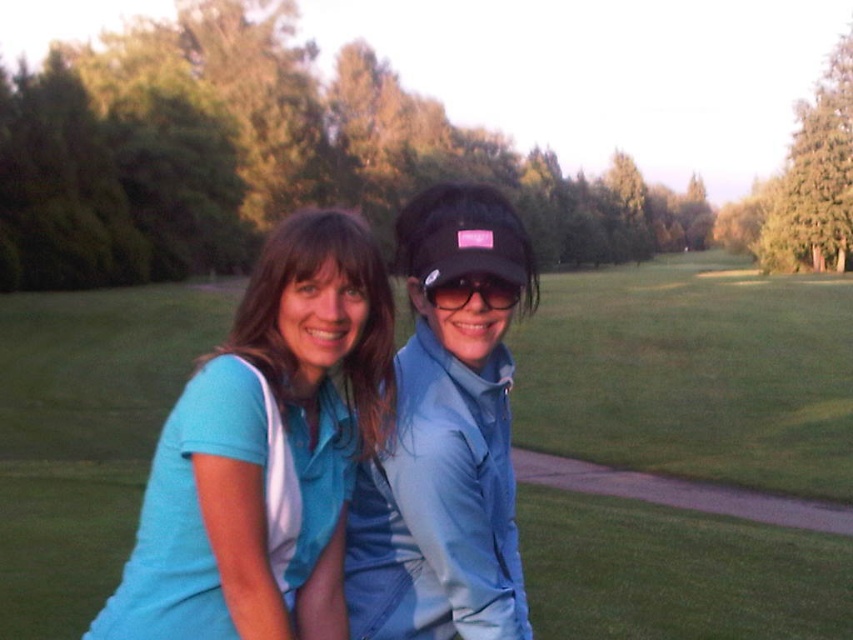
Question: Which object appears closest to the camera in this image?

Choices:
 (A) green grass at center
 (B) black matte sunglasses at center
 (C) matte blue shirt at center

Answer: (C)

Question: Does matte blue jacket at center appear on the left side of black matte sunglasses at center?

Choices:
 (A) yes
 (B) no

Answer: (A)

Question: Is the position of matte blue jacket at center less distant than that of black matte sunglasses at center?

Choices:
 (A) no
 (B) yes

Answer: (B)

Question: Which of these objects is positioned closest to the black matte sunglasses at center?

Choices:
 (A) matte blue shirt at center
 (B) matte blue jacket at center
 (C) green grass at center

Answer: (B)

Question: Can you confirm if matte blue shirt at center is smaller than black matte sunglasses at center?

Choices:
 (A) no
 (B) yes

Answer: (A)

Question: Which of the following is the farthest from the observer?

Choices:
 (A) green grass at center
 (B) black matte sunglasses at center
 (C) matte blue jacket at center
 (D) matte blue shirt at center

Answer: (A)